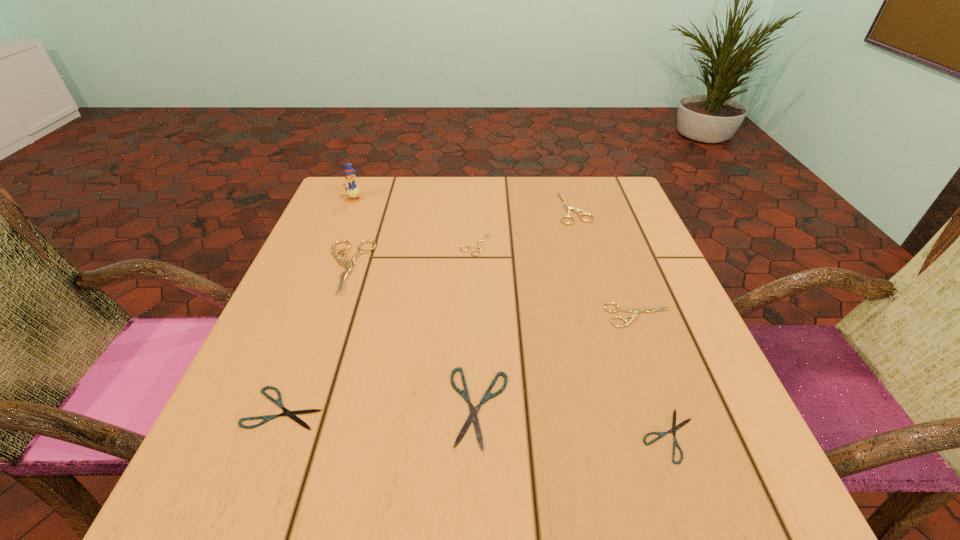
Locate an element on the screen. This screenshot has width=960, height=540. vacant region at the right edge of the desktop is located at coordinates (731, 429).

Locate an element on the screen. vacant space at the far left corner of the desktop is located at coordinates (333, 189).

The width and height of the screenshot is (960, 540). Identify the location of free location at the far right corner of the desktop. (614, 225).

What are the coordinates of `vacant area that lies between the farthest shears and the second beige shears from left to right` in the screenshot? It's located at [x=525, y=226].

The width and height of the screenshot is (960, 540). I want to click on free space between the third beige shears from right to left and the tallest shears, so click(412, 256).

The width and height of the screenshot is (960, 540). I want to click on empty space between the second biggest black shears and the smallest beige shears, so click(x=380, y=326).

The width and height of the screenshot is (960, 540). Find the location of `empty space between the smallest beige shears and the second black shears from left to right`. empty space between the smallest beige shears and the second black shears from left to right is located at coordinates (477, 326).

The image size is (960, 540). In order to click on free spot between the seventh shortest object and the second black shears from left to right in this screenshot , I will do `click(413, 337)`.

Find the location of a particular element. The image size is (960, 540). vacant space that is in between the rightmost black shears and the second biggest beige shears is located at coordinates 622,322.

The image size is (960, 540). I want to click on vacant space in between the shortest shears and the biggest black shears, so click(x=574, y=421).